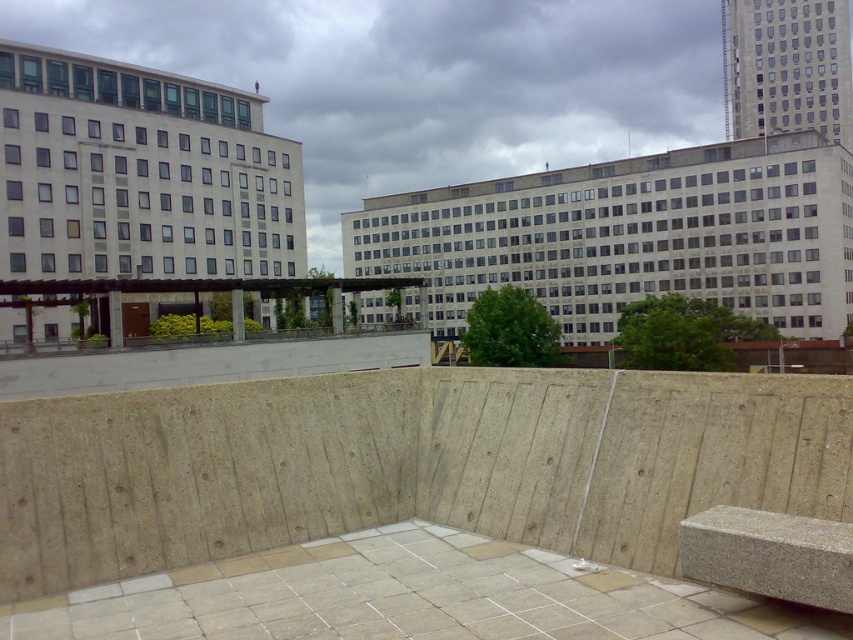
Question: Can you confirm if gray concrete bench at lower right is positioned to the left of concrete ledge at center?

Choices:
 (A) no
 (B) yes

Answer: (A)

Question: Estimate the real-world distances between objects in this image. Which object is farther from the gray concrete bench at lower right?

Choices:
 (A) granite bench at lower right
 (B) concrete ledge at center

Answer: (B)

Question: Which point is farther from the camera taking this photo?

Choices:
 (A) (142, 356)
 (B) (769, 595)
 (C) (383, 628)

Answer: (A)

Question: From the image, what is the correct spatial relationship of concrete ledge at center in relation to granite bench at lower right?

Choices:
 (A) left
 (B) right

Answer: (A)

Question: Can you confirm if gray concrete bench at lower right is smaller than granite bench at lower right?

Choices:
 (A) yes
 (B) no

Answer: (B)

Question: Which point is closer to the camera?

Choices:
 (A) (279, 376)
 (B) (772, 522)
 (C) (305, 625)

Answer: (C)